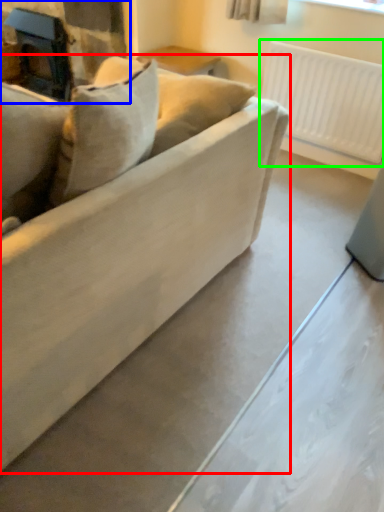
Question: Which object is positioned closest to studio couch (highlighted by a red box)? Select from fireplace (highlighted by a blue box) and radiator (highlighted by a green box).

Choices:
 (A) fireplace
 (B) radiator

Answer: (B)